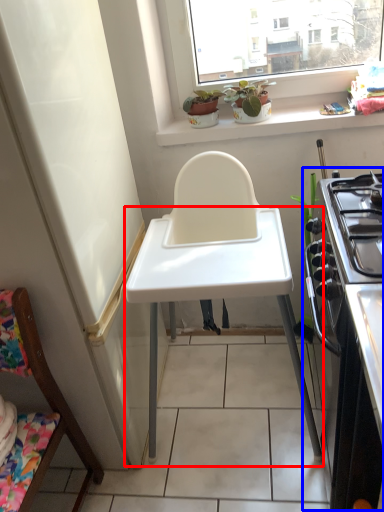
Question: Among these objects, which one is nearest to the camera, table (highlighted by a red box) or appliance (highlighted by a blue box)?

Choices:
 (A) table
 (B) appliance

Answer: (B)